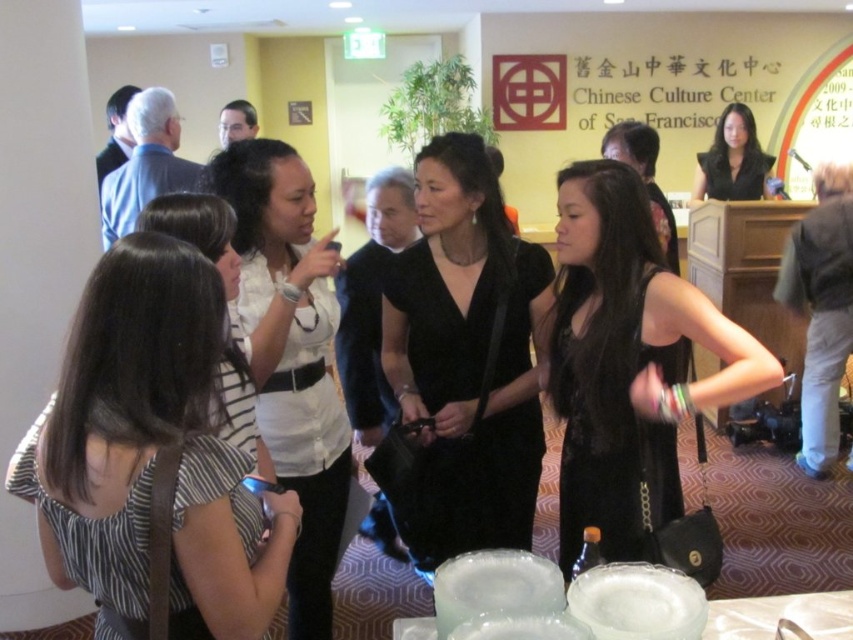
Identify the location of black lace dress at center. This screenshot has height=640, width=853. (628, 364).

Does point (618, 435) come farther from viewer compared to point (248, 444)?

Yes, it is behind point (248, 444).

You are a GUI agent. You are given a task and a screenshot of the screen. Output one action in this format:
    pyautogui.click(x=<x>, y=<y>)
    Task: Click on the black lace dress at center
    The height and width of the screenshot is (640, 853).
    Given the screenshot: What is the action you would take?
    pyautogui.click(x=628, y=364)

Between point (227, 172) and point (701, 195), which one is positioned in front?

Point (227, 172) is in front.

Can you confirm if white matte shirt at center is shorter than black silk dress at upper right?

No.

You are a GUI agent. You are given a task and a screenshot of the screen. Output one action in this format:
    pyautogui.click(x=<x>, y=<y>)
    Task: Click on the white matte shirt at center
    
    Given the screenshot: What is the action you would take?
    pyautogui.click(x=293, y=356)

Is point (538, 250) farther from camera compared to point (367, 225)?

No, it is not.

Is the position of black velvet dress at center less distant than that of black leather handbag at center?

Yes, it is.

What are the coordinates of `black velvet dress at center` in the screenshot? It's located at (467, 355).

I want to click on black velvet dress at center, so click(467, 355).